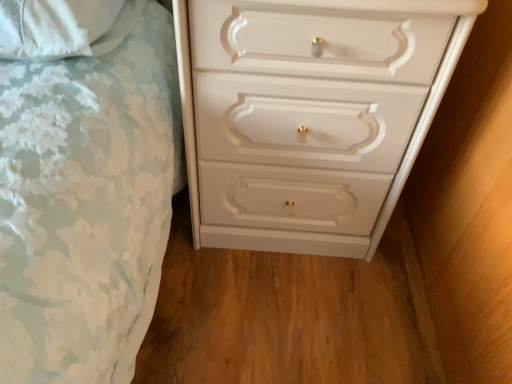
You are a GUI agent. You are given a task and a screenshot of the screen. Output one action in this format:
    pyautogui.click(x=<x>, y=<y>)
    Task: Click on the vacant region in front of white painted wood chest of drawers at lower right
    The width and height of the screenshot is (512, 384).
    Given the screenshot: What is the action you would take?
    pyautogui.click(x=287, y=313)